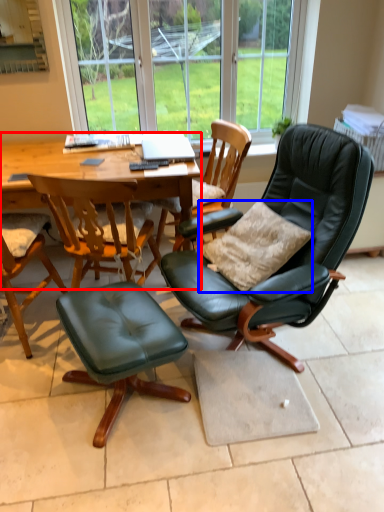
Question: Which object appears farthest to the camera in this image, round table (highlighted by a red box) or pillow (highlighted by a blue box)?

Choices:
 (A) round table
 (B) pillow

Answer: (A)